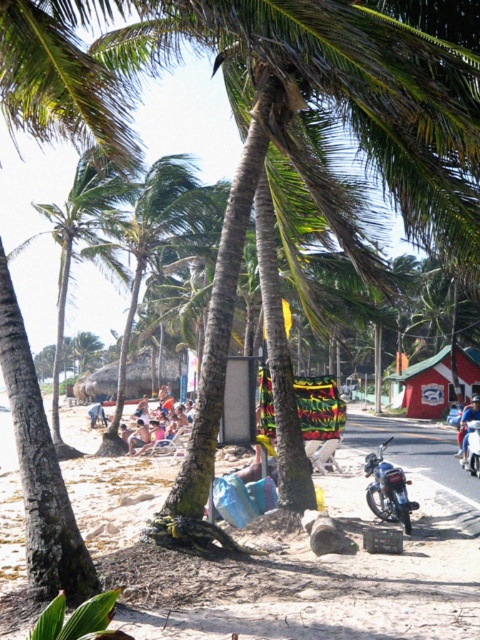
Question: Which object is the closest to the beige fabric chair at center?

Choices:
 (A) shiny chrome motorcycle at lower right
 (B) beach sand at lower left
 (C) metallic blue motorcycle at center

Answer: (B)

Question: Is shiny chrome motorcycle at lower right bigger than metallic blue motorcycle at center?

Choices:
 (A) no
 (B) yes

Answer: (A)

Question: Does beach sand at lower left appear on the right side of metallic blue motorcycle at center?

Choices:
 (A) yes
 (B) no

Answer: (B)

Question: Among these objects, which one is farthest from the camera?

Choices:
 (A) beach sand at lower left
 (B) metallic blue motorcycle at center

Answer: (B)

Question: Which of the following is the closest to the observer?

Choices:
 (A) (140, 433)
 (B) (468, 417)

Answer: (B)

Question: Is shiny chrome motorcycle at lower right to the right of metallic blue motorcycle at center from the viewer's perspective?

Choices:
 (A) yes
 (B) no

Answer: (B)